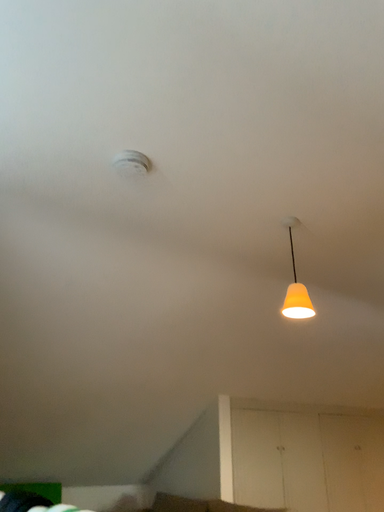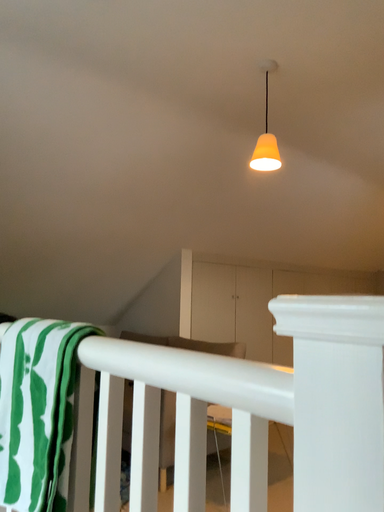
Question: How did the camera likely rotate when shooting the video?

Choices:
 (A) rotated upward
 (B) rotated downward

Answer: (B)